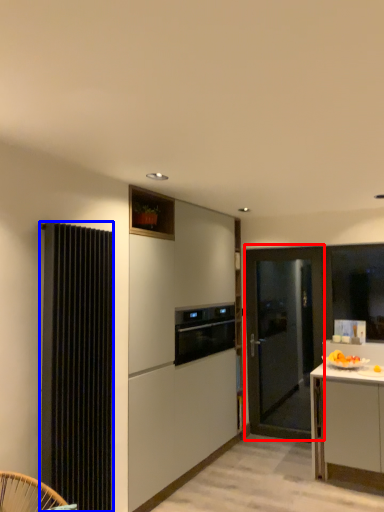
Question: Which point is further to the camera, door (highlighted by a red box) or radiator (highlighted by a blue box)?

Choices:
 (A) door
 (B) radiator

Answer: (A)